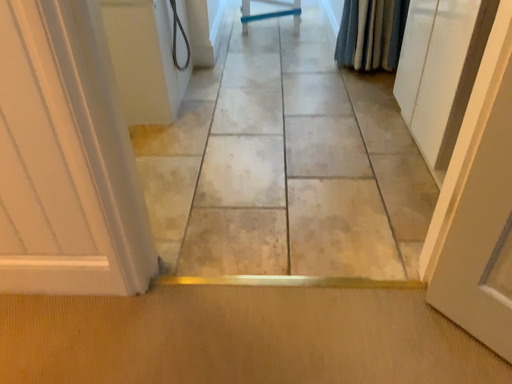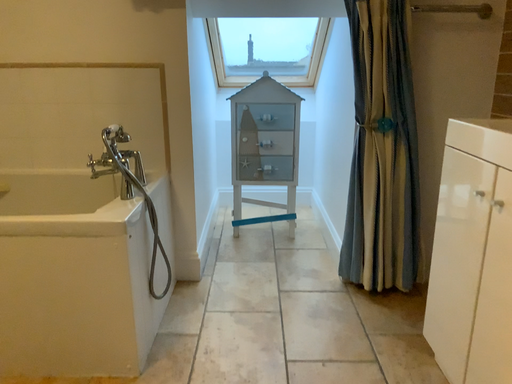
Question: How did the camera likely rotate when shooting the video?

Choices:
 (A) rotated upward
 (B) rotated downward

Answer: (A)